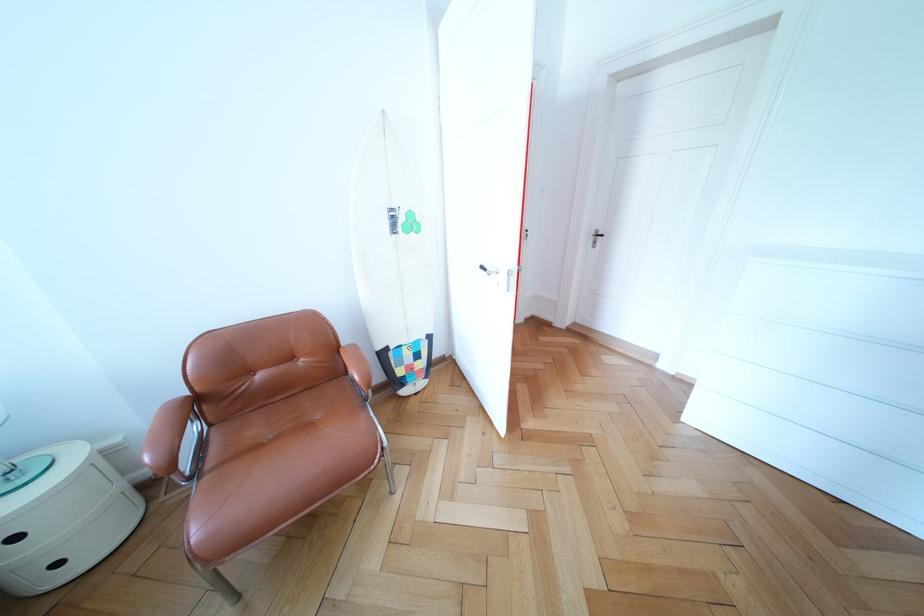
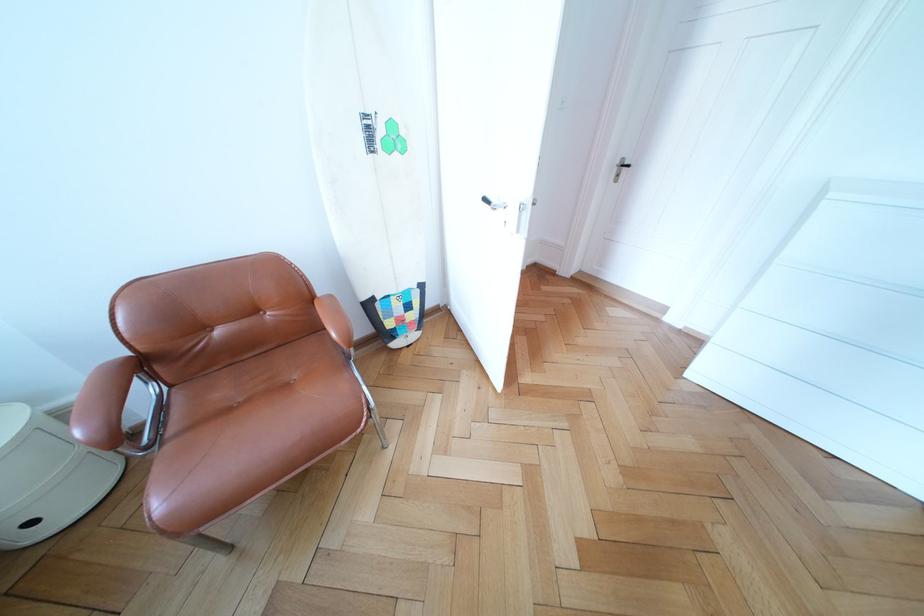
Find the pixel in the second image that matches point (403, 353) in the first image.

(390, 304)